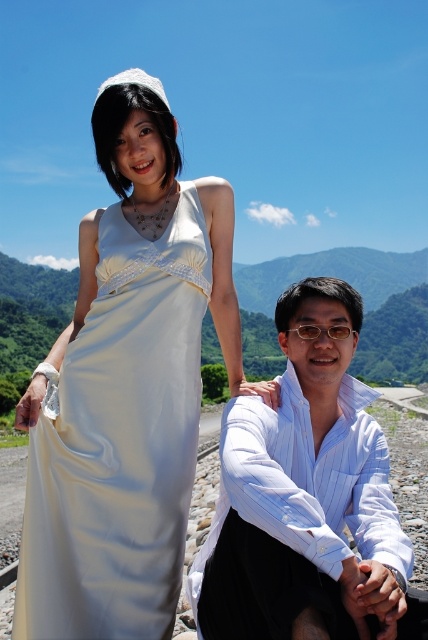
Question: Which of the following is the closest to the observer?

Choices:
 (A) white striped shirt at center
 (B) satin white dress at center

Answer: (A)

Question: Does satin white dress at center appear over white striped shirt at center?

Choices:
 (A) yes
 (B) no

Answer: (A)

Question: Does satin white dress at center have a greater width compared to white striped shirt at center?

Choices:
 (A) yes
 (B) no

Answer: (B)

Question: Is satin white dress at center bigger than white striped shirt at center?

Choices:
 (A) no
 (B) yes

Answer: (B)